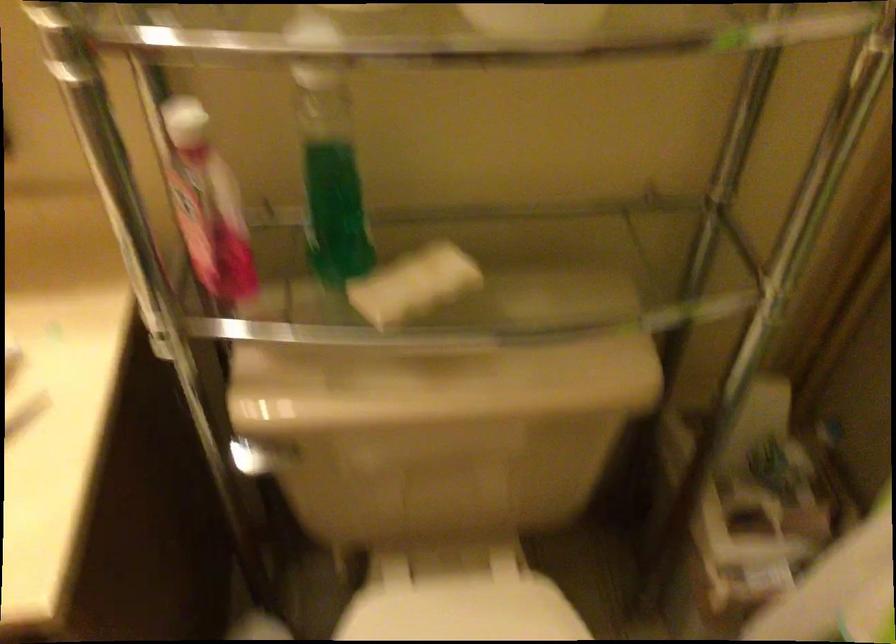
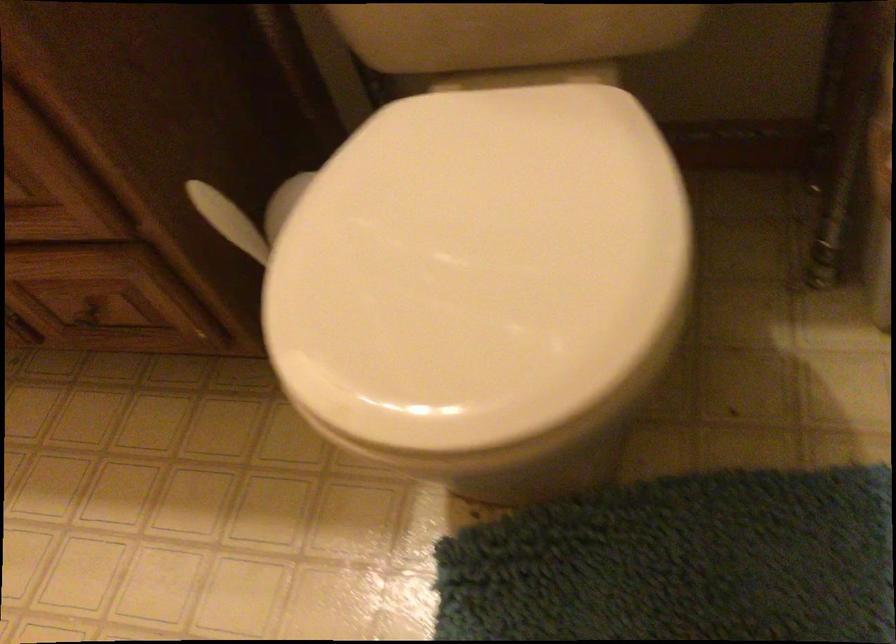
Question: Based on the continuous images, in which direction is the camera rotating? Reply with the corresponding letter.

Choices:
 (A) Left
 (B) Right
 (C) Up
 (D) Down

Answer: (A)